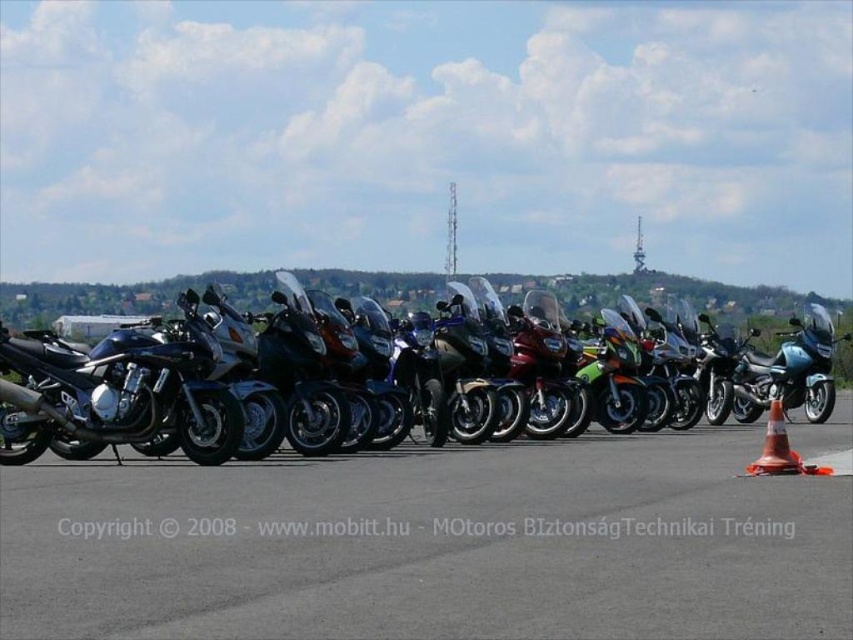
Measure the distance between metallic motorcycles at center and shiny chrome motorcycle at center.

A distance of 77.27 feet exists between metallic motorcycles at center and shiny chrome motorcycle at center.

Where is `metallic motorcycles at center`? metallic motorcycles at center is located at coordinates pyautogui.click(x=432, y=545).

Which is in front, point (206, 278) or point (782, 433)?

Point (782, 433)

Is point (666, 298) more distant than point (755, 474)?

Yes, point (666, 298) is farther from viewer.

I want to click on shiny chrome motorcycle at center, so [676, 298].

What do you see at coordinates (432, 545) in the screenshot? I see `metallic motorcycles at center` at bounding box center [432, 545].

Locate an element on the screen. This screenshot has width=853, height=640. metallic motorcycles at center is located at coordinates (432, 545).

Identify the location of metallic motorcycles at center. The image size is (853, 640). (432, 545).